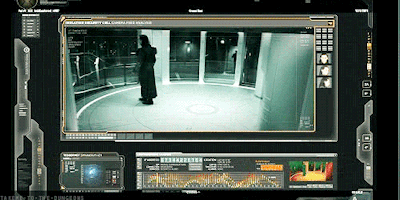
In order to click on light/lamp in this screenshot , I will do `click(187, 50)`.